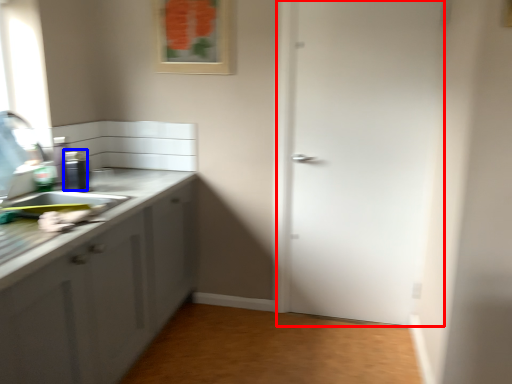
Question: Among these objects, which one is nearest to the camera, door (highlighted by a red box) or appliance (highlighted by a blue box)?

Choices:
 (A) door
 (B) appliance

Answer: (B)